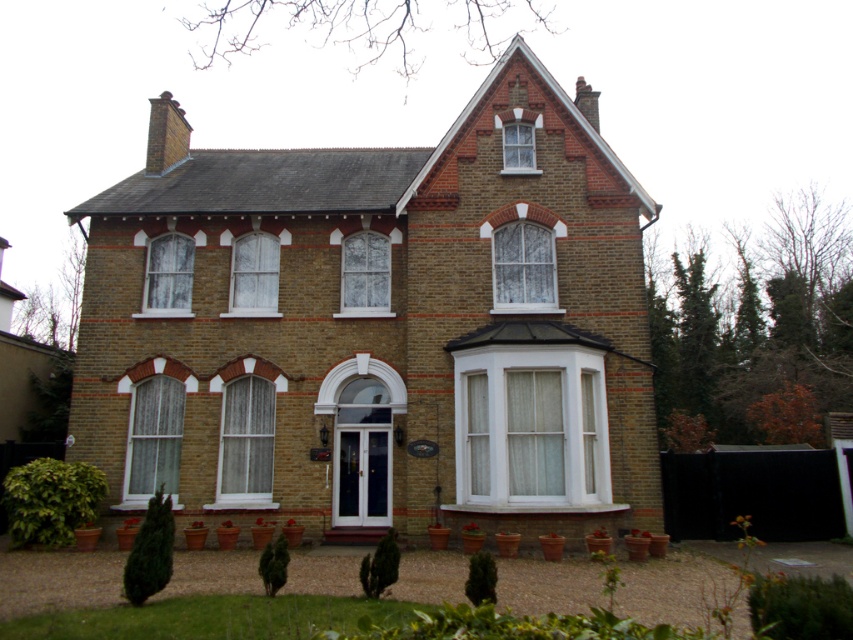
Question: Which object is farther from the camera taking this photo?

Choices:
 (A) white glass window at center
 (B) clear glass window at upper center

Answer: (B)

Question: Which point appears closest to the camera in this image?

Choices:
 (A) (268, 236)
 (B) (187, 241)
 (C) (596, 500)
 (D) (163, 470)

Answer: (C)

Question: Does white textured window at center appear under white glass window at center?

Choices:
 (A) no
 (B) yes

Answer: (B)

Question: Considering the real-world distances, which object is farthest from the white glass window at center?

Choices:
 (A) white textured glass at upper left
 (B) clear glass window at center

Answer: (B)

Question: Can you confirm if white textured glass at upper center is smaller than white textured glass at upper left?

Choices:
 (A) no
 (B) yes

Answer: (B)

Question: Does white textured window at center have a larger size compared to white textured glass at upper center?

Choices:
 (A) no
 (B) yes

Answer: (A)